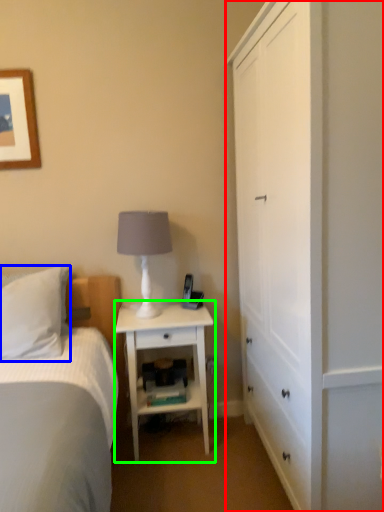
Question: Which is nearer to the cabinetry (highlighted by a red box)? pillow (highlighted by a blue box) or nightstand (highlighted by a green box).

Choices:
 (A) pillow
 (B) nightstand

Answer: (B)